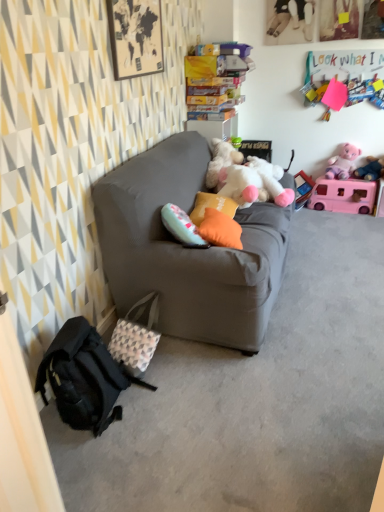
Question: Should I look upward or downward to see white plush toy at center, marked as the 5th toy in a top-to-bottom arrangement?

Choices:
 (A) up
 (B) down

Answer: (A)

Question: Is orange fabric pillow at center, acting as the 2th pillow starting from the front, smaller than pink plush toy at upper right, the third toy in the bottom-to-top sequence?

Choices:
 (A) yes
 (B) no

Answer: (A)

Question: Does orange fabric pillow at center, arranged as the first pillow when viewed from the back, have a larger size compared to pink plush toy at upper right, the third toy in the bottom-to-top sequence?

Choices:
 (A) no
 (B) yes

Answer: (A)

Question: Could you tell me if orange fabric pillow at center, arranged as the first pillow when viewed from the back, is facing pink plush toy at upper right, marked as the third toy in a top-to-bottom arrangement?

Choices:
 (A) yes
 (B) no

Answer: (B)

Question: From the image's perspective, is orange fabric pillow at center, arranged as the first pillow when viewed from the back, located above pink plush toy at upper right, the third toy in the bottom-to-top sequence?

Choices:
 (A) no
 (B) yes

Answer: (A)

Question: Is orange fabric pillow at center, arranged as the first pillow when viewed from the back, taller than pink plush toy at upper right, the third toy in the bottom-to-top sequence?

Choices:
 (A) no
 (B) yes

Answer: (A)

Question: Can you see orange fabric pillow at center, arranged as the first pillow when viewed from the back, touching pink plush toy at upper right, marked as the third toy in a top-to-bottom arrangement?

Choices:
 (A) no
 (B) yes

Answer: (A)

Question: Is pink plastic toy at upper right, the 2th toy ordered from the bottom, positioned far away from orange fabric pillow at center, the second pillow positioned from the back?

Choices:
 (A) no
 (B) yes

Answer: (B)

Question: Is pink plastic toy at upper right, the 2th toy ordered from the bottom, at the right side of orange fabric pillow at center, arranged as the 1th pillow when viewed from the front?

Choices:
 (A) yes
 (B) no

Answer: (A)

Question: From a real-world perspective, does pink plastic toy at upper right, the fourth toy viewed from the top, sit lower than orange fabric pillow at center, arranged as the 1th pillow when viewed from the front?

Choices:
 (A) yes
 (B) no

Answer: (A)

Question: From a real-world perspective, is pink plastic toy at upper right, the fourth toy viewed from the top, on orange fabric pillow at center, the second pillow positioned from the back?

Choices:
 (A) no
 (B) yes

Answer: (A)

Question: Considering the relative sizes of pink plastic toy at upper right, the 2th toy ordered from the bottom, and orange fabric pillow at center, the second pillow positioned from the back, in the image provided, is pink plastic toy at upper right, the 2th toy ordered from the bottom, bigger than orange fabric pillow at center, the second pillow positioned from the back,?

Choices:
 (A) yes
 (B) no

Answer: (A)

Question: Does pink plastic toy at upper right, the fourth toy viewed from the top, have a lesser width compared to orange fabric pillow at center, arranged as the 1th pillow when viewed from the front?

Choices:
 (A) yes
 (B) no

Answer: (B)

Question: From the image's perspective, is patterned fabric bag at lower left beneath white plush toy at center, marked as the 5th toy in a top-to-bottom arrangement?

Choices:
 (A) yes
 (B) no

Answer: (A)